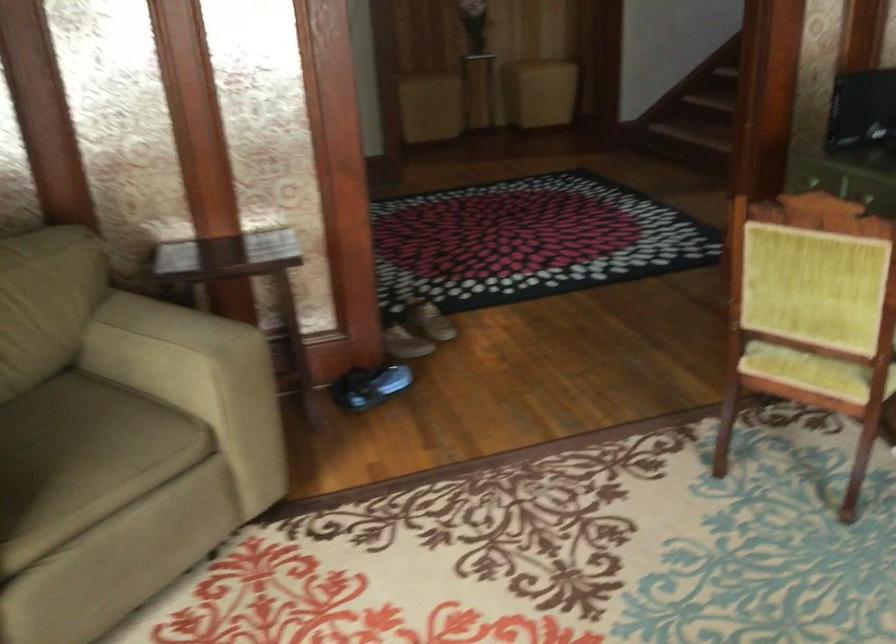
The image size is (896, 644). Describe the element at coordinates (819, 373) in the screenshot. I see `the chair sitting surface` at that location.